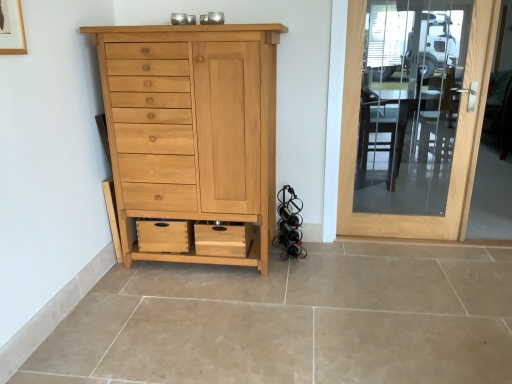
Describe the element at coordinates (455, 138) in the screenshot. I see `clear glass door at right` at that location.

Where is `clear glass door at right`? The image size is (512, 384). clear glass door at right is located at coordinates coord(455,138).

This screenshot has width=512, height=384. What do you see at coordinates (192, 129) in the screenshot? I see `natural wood cabinet at center` at bounding box center [192, 129].

Identify the location of natural wood cabinet at center. (192, 129).

Find the location of `clear glass door at right`. clear glass door at right is located at coordinates (455, 138).

Consider the image. Considering the positions of objects clear glass door at right and natural wood cabinet at center in the image provided, who is more to the right, clear glass door at right or natural wood cabinet at center?

clear glass door at right.

Does clear glass door at right come behind natural wood cabinet at center?

Yes.

Considering the points (355, 104) and (140, 142), which point is behind, point (355, 104) or point (140, 142)?

The point (355, 104) is farther from the camera.

From the image's perspective, is clear glass door at right beneath natural wood cabinet at center?

Incorrect, from the image's perspective, clear glass door at right is higher than natural wood cabinet at center.

From a real-world perspective, is clear glass door at right under natural wood cabinet at center?

No.

Can you confirm if clear glass door at right is wider than natural wood cabinet at center?

No.

Is clear glass door at right taller or shorter than natural wood cabinet at center?

In the image, clear glass door at right appears to be taller than natural wood cabinet at center.

Is clear glass door at right bigger than natural wood cabinet at center?

Actually, clear glass door at right might be smaller than natural wood cabinet at center.

Is clear glass door at right not inside natural wood cabinet at center?

Yes, clear glass door at right is located beyond the bounds of natural wood cabinet at center.

Would you consider clear glass door at right to be distant from natural wood cabinet at center?

Yes.

Consider the image. Is clear glass door at right looking in the opposite direction of natural wood cabinet at center?

That's not correct — clear glass door at right is not looking away from natural wood cabinet at center.

How many degrees apart are the facing directions of clear glass door at right and natural wood cabinet at center?

They differ by 0.967 degrees in their facing directions.

In the image, there is a clear glass door at right. At what (x,y) coordinates should I click in order to perform the action: click on the chest of drawers below it (from a real-world perspective). Please return your answer as a coordinate pair (x, y). Looking at the image, I should click on (192, 129).

Is natural wood cabinet at center at the left side of clear glass door at right?

Correct, you'll find natural wood cabinet at center to the left of clear glass door at right.

Which object is closer to the camera, natural wood cabinet at center or clear glass door at right?

natural wood cabinet at center.

Is point (215, 128) closer or farther from the camera than point (352, 13)?

Clearly, point (215, 128) is closer to the camera than point (352, 13).

From the image's perspective, is natural wood cabinet at center located above or below clear glass door at right?

Based on their image positions, natural wood cabinet at center is located beneath clear glass door at right.

From a real-world perspective, who is located higher, natural wood cabinet at center or clear glass door at right?

In real-world perspective, clear glass door at right is above.

In terms of width, does natural wood cabinet at center look wider or thinner when compared to clear glass door at right?

natural wood cabinet at center is wider than clear glass door at right.

Is natural wood cabinet at center taller than clear glass door at right?

No.

Does natural wood cabinet at center have a larger size compared to clear glass door at right?

Indeed, natural wood cabinet at center has a larger size compared to clear glass door at right.

Can we say natural wood cabinet at center lies outside clear glass door at right?

Absolutely, natural wood cabinet at center is external to clear glass door at right.

Is natural wood cabinet at center next to clear glass door at right and touching it?

They are not placed beside each other.

Does natural wood cabinet at center turn towards clear glass door at right?

No, natural wood cabinet at center is not facing towards clear glass door at right.

In order to click on door on the right of natural wood cabinet at center in this screenshot , I will do `click(455, 138)`.

You are a GUI agent. You are given a task and a screenshot of the screen. Output one action in this format:
    pyautogui.click(x=<x>, y=<y>)
    Task: Click on the chest of drawers below the clear glass door at right (from a real-world perspective)
    This screenshot has height=384, width=512.
    Given the screenshot: What is the action you would take?
    pyautogui.click(x=192, y=129)

The width and height of the screenshot is (512, 384). I want to click on door that appears above the natural wood cabinet at center (from the image's perspective), so click(455, 138).